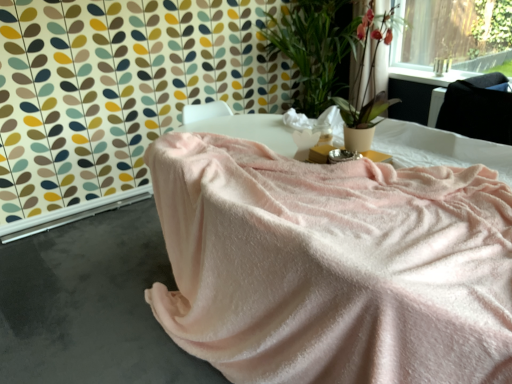
Question: Based on their sizes in the image, would you say green leafy plant at upper right is bigger or smaller than pink soft fabric at lower left?

Choices:
 (A) big
 (B) small

Answer: (A)

Question: Is green leafy plant at upper right to the left or to the right of pink soft fabric at lower left in the image?

Choices:
 (A) right
 (B) left

Answer: (A)

Question: Which object is positioned farthest from the pink soft fabric at center?

Choices:
 (A) satin black at upper right
 (B) green leafy plant at upper right
 (C) pink soft fabric at lower left
 (D) pink fabric at upper right

Answer: (B)

Question: Based on their relative distances, which object is nearer to the pink soft fabric at center?

Choices:
 (A) satin black at upper right
 (B) pink soft fabric at lower left
 (C) pink fabric at upper right
 (D) green leafy plant at upper right

Answer: (B)